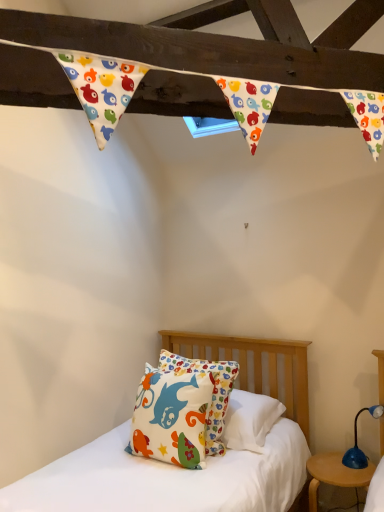
Question: From a real-world perspective, does blue plastic table lamp at lower right sit lower than wooden round table at lower right?

Choices:
 (A) no
 (B) yes

Answer: (A)

Question: Is blue plastic table lamp at lower right positioned before wooden round table at lower right?

Choices:
 (A) no
 (B) yes

Answer: (A)

Question: Does blue plastic table lamp at lower right have a greater height compared to wooden round table at lower right?

Choices:
 (A) yes
 (B) no

Answer: (B)

Question: From the image's perspective, is blue plastic table lamp at lower right over wooden round table at lower right?

Choices:
 (A) no
 (B) yes

Answer: (B)

Question: Does blue plastic table lamp at lower right turn towards wooden round table at lower right?

Choices:
 (A) no
 (B) yes

Answer: (A)

Question: Considering the relative positions of blue plastic table lamp at lower right and wooden round table at lower right in the image provided, is blue plastic table lamp at lower right to the left of wooden round table at lower right from the viewer's perspective?

Choices:
 (A) yes
 (B) no

Answer: (B)

Question: Is blue plastic table lamp at lower right touching matte cotton pillow at center?

Choices:
 (A) no
 (B) yes

Answer: (A)

Question: Is matte cotton pillow at center surrounded by blue plastic table lamp at lower right?

Choices:
 (A) no
 (B) yes

Answer: (A)

Question: Can you confirm if blue plastic table lamp at lower right is wider than matte cotton pillow at center?

Choices:
 (A) yes
 (B) no

Answer: (B)

Question: Does blue plastic table lamp at lower right have a larger size compared to matte cotton pillow at center?

Choices:
 (A) yes
 (B) no

Answer: (B)

Question: Is there a large distance between blue plastic table lamp at lower right and matte cotton pillow at center?

Choices:
 (A) yes
 (B) no

Answer: (B)

Question: From the image's perspective, is blue plastic table lamp at lower right on top of matte cotton pillow at center?

Choices:
 (A) yes
 (B) no

Answer: (B)

Question: Is there a large distance between matte cotton pillow at center and blue plastic table lamp at lower right?

Choices:
 (A) yes
 (B) no

Answer: (B)